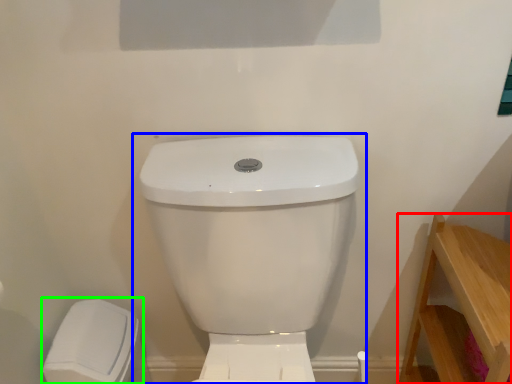
Question: Estimate the real-world distances between objects in this image. Which object is farther from furniture (highlighted by a red box), toilet (highlighted by a blue box) or porcelain (highlighted by a green box)?

Choices:
 (A) toilet
 (B) porcelain

Answer: (B)